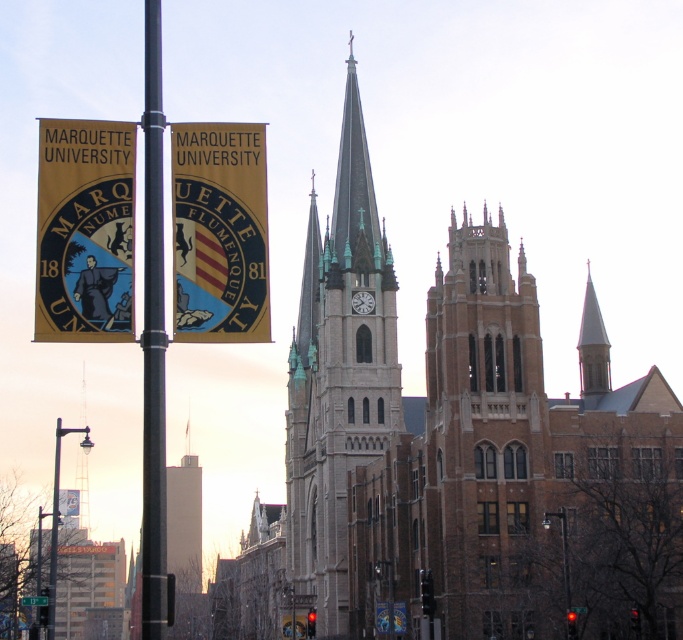
You are standing at the entrance of Marquette University and want to take a photo of the smooth gray steeple at upper right. However, you notice the metallic streetlight at lower left might block your view. Based on their positions, will the streetlight block the steeple in your photo?

The smooth gray steeple at upper right is positioned over the metallic streetlight at lower left, so the streetlight will not block the steeple in your photo because it is below it.

You are standing at the point marked by the coordinate point at point [598,364]. You want to walk to the nearest banner. Which direction should you go?

The banners are located to the left of the church, so you should head towards the left to reach them.